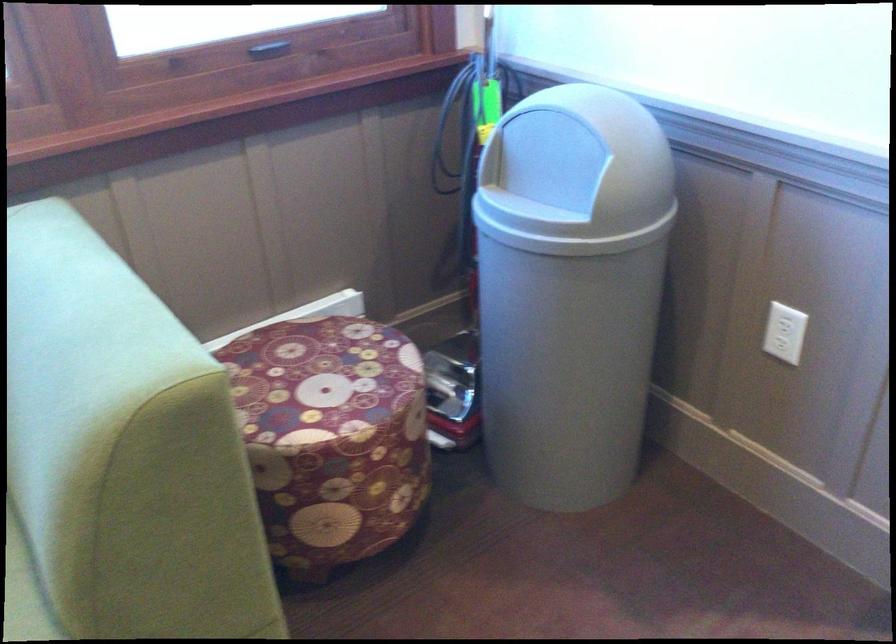
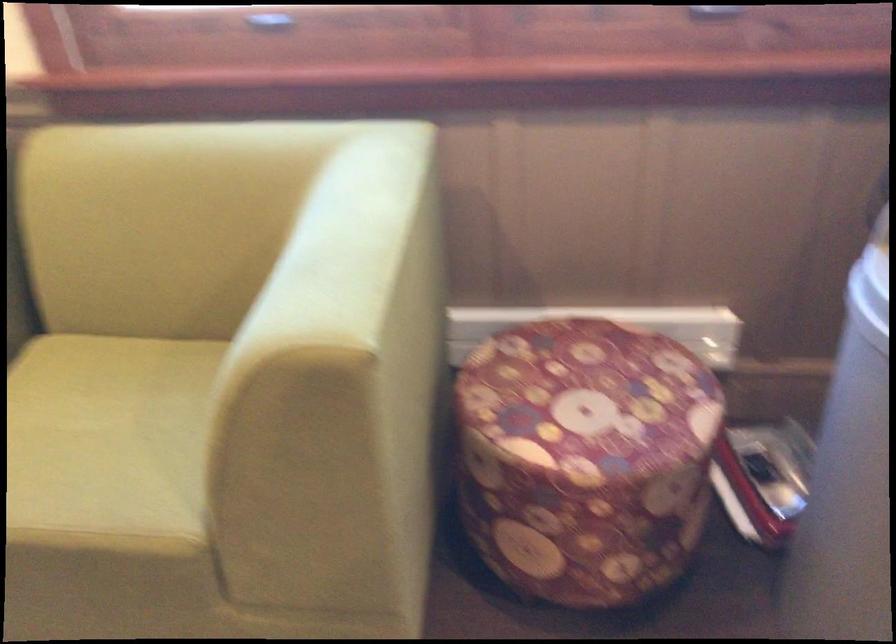
The point at (x=89, y=292) is marked in the first image. Where is the corresponding point in the second image?

(358, 223)